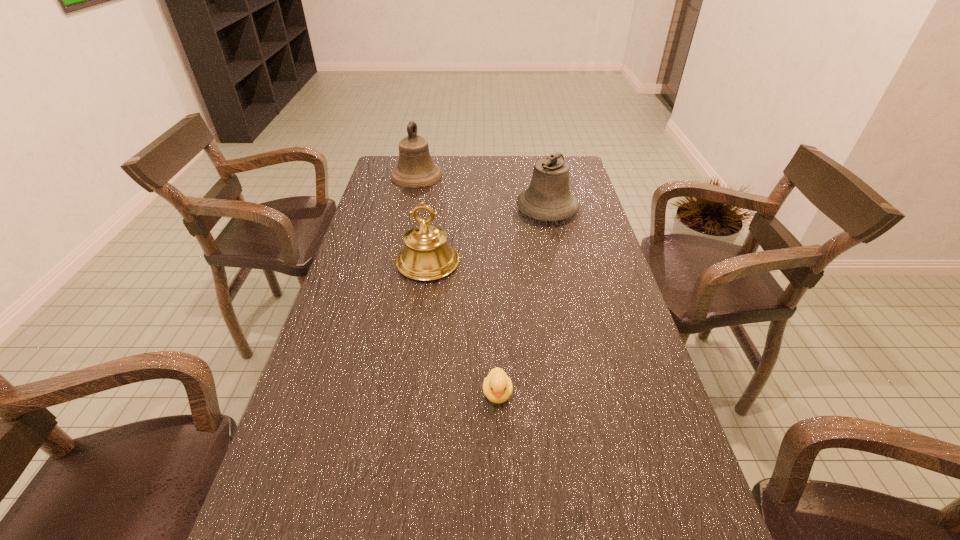
Locate an element on the screen. vacant space that satisfies the following two spatial constraints: 1. on the back side of the nearest bell; 2. on the left side of the second farthest object is located at coordinates (436, 210).